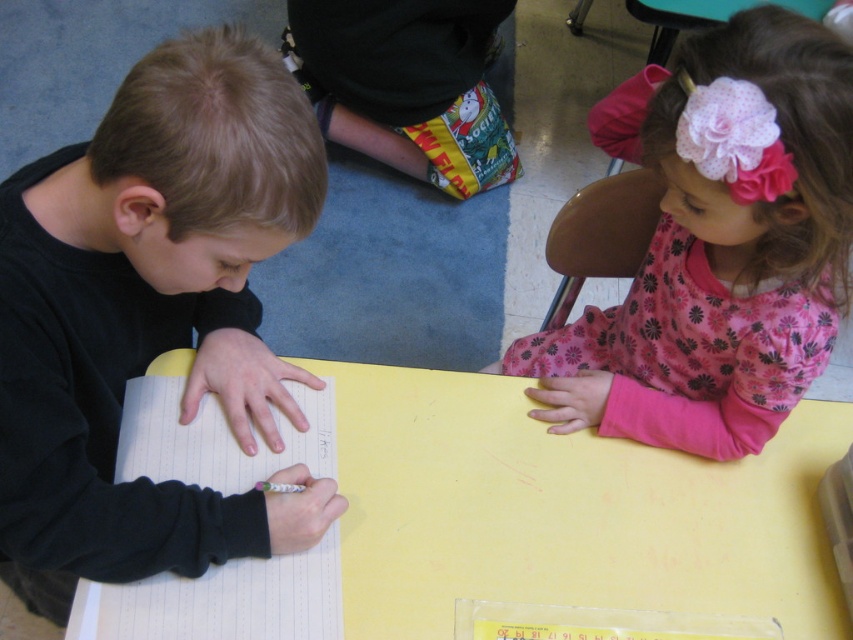
Question: Can you confirm if black matte shirt at left is positioned to the left of white paper notebook at left?

Choices:
 (A) no
 (B) yes

Answer: (B)

Question: Which of the following is the farthest from the observer?

Choices:
 (A) (471, 548)
 (B) (9, 234)

Answer: (A)

Question: Which object appears farthest from the camera in this image?

Choices:
 (A) pink floral dress at upper right
 (B) white paper notebook at left

Answer: (B)

Question: Does yellow matte table at center have a larger size compared to white paper notebook at left?

Choices:
 (A) no
 (B) yes

Answer: (B)

Question: Which point is farther to the camera?

Choices:
 (A) (91, 371)
 (B) (141, 417)
 (C) (392, 163)

Answer: (C)

Question: Can you confirm if yellow matte table at center is positioned below white paper notebook at left?

Choices:
 (A) no
 (B) yes

Answer: (B)